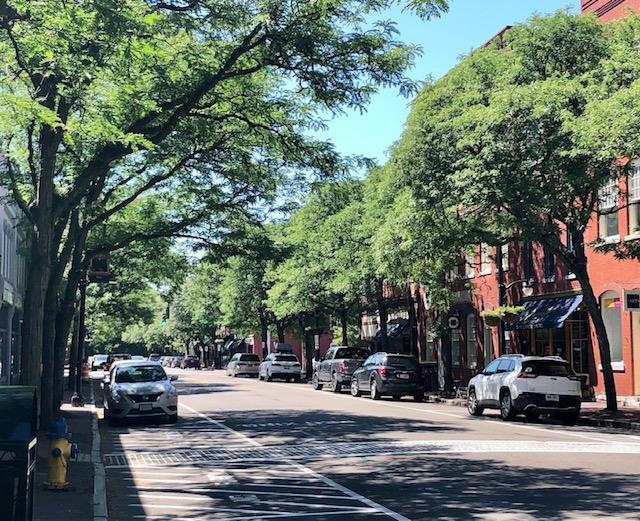
Locate an element on the screen. shade is located at coordinates (536, 494).